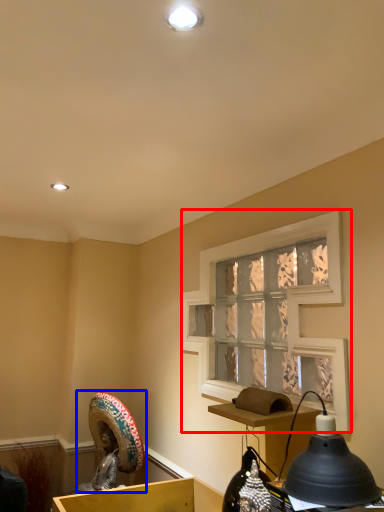
Question: Which object is closer to the camera taking this photo, window screen (highlighted by a red box) or sculpture (highlighted by a blue box)?

Choices:
 (A) window screen
 (B) sculpture

Answer: (A)